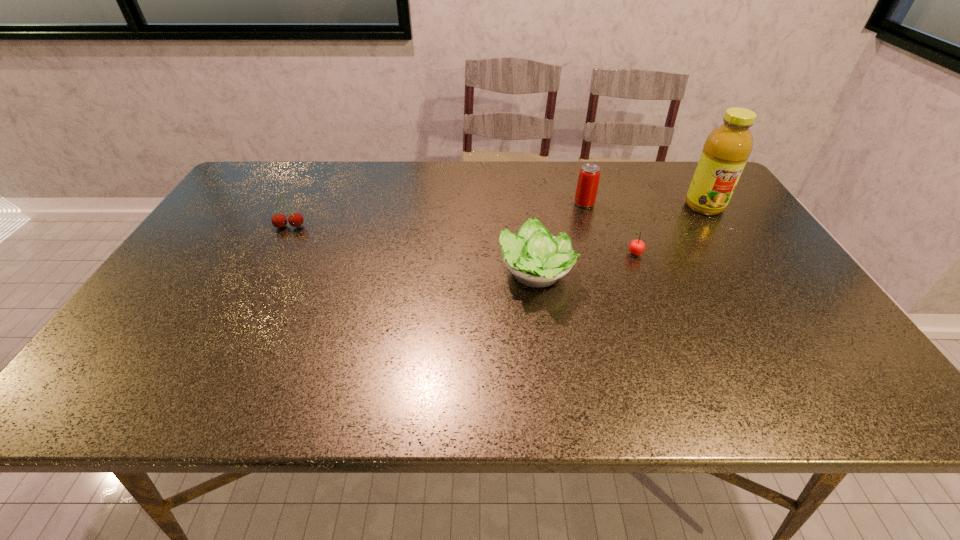
Locate an element on the screen. This screenshot has width=960, height=540. free space between the farther cherry and the fourth object from right to left is located at coordinates (413, 251).

Image resolution: width=960 pixels, height=540 pixels. Identify the location of vacant area that lies between the fruit juice and the lettuce. (620, 240).

You are a GUI agent. You are given a task and a screenshot of the screen. Output one action in this format:
    pyautogui.click(x=<x>, y=<y>)
    Task: Click on the vacant space that's between the shorter cherry and the second object from left to right
    This screenshot has height=540, width=960.
    Given the screenshot: What is the action you would take?
    pyautogui.click(x=586, y=265)

Where is `empty space between the rightmost object and the nearer cherry`? This screenshot has width=960, height=540. empty space between the rightmost object and the nearer cherry is located at coordinates (669, 230).

At what (x,y) coordinates should I click in order to perform the action: click on object that stands as the second closest to the left cherry. Please return your answer as a coordinate pair (x, y). Looking at the image, I should click on (587, 186).

Locate an element on the screen. object that is the closest to the lettuce is located at coordinates (636, 247).

Where is `blank area in the image that satisfies the following two spatial constraints: 1. on the surface of the left cherry; 2. on the left side of the shortest object`? This screenshot has width=960, height=540. blank area in the image that satisfies the following two spatial constraints: 1. on the surface of the left cherry; 2. on the left side of the shortest object is located at coordinates (276, 254).

Locate an element on the screen. Image resolution: width=960 pixels, height=540 pixels. free space that satisfies the following two spatial constraints: 1. on the surface of the leftmost object; 2. on the left side of the lettuce is located at coordinates (265, 275).

Identify the location of free space that satisfies the following two spatial constraints: 1. on the surface of the third farthest object; 2. on the left side of the nearer cherry. The height and width of the screenshot is (540, 960). (276, 254).

Locate an element on the screen. blank space that satisfies the following two spatial constraints: 1. on the surface of the fourth object from left to right; 2. on the right side of the third farthest object is located at coordinates (276, 254).